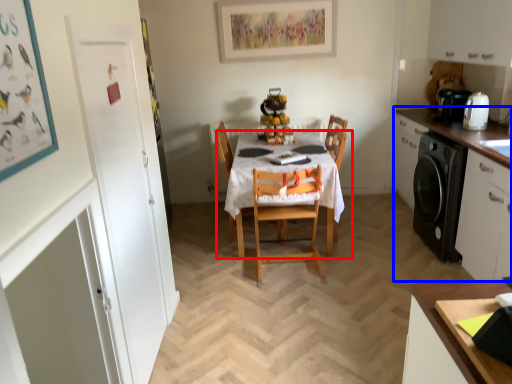
Question: Which point is further to the camera, kitchen & dining room table (highlighted by a red box) or cabinetry (highlighted by a blue box)?

Choices:
 (A) kitchen & dining room table
 (B) cabinetry

Answer: (A)